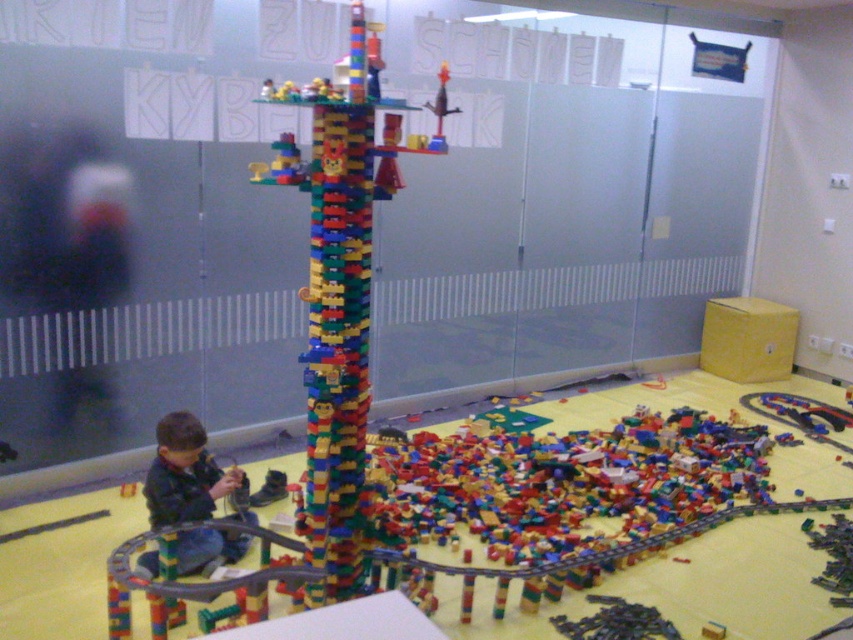
You are a parent trying to find your child who is playing in the play area. You see the multicolored plastic tower at center and the dark blue denim jacket at lower left. Which object is closer to the entrance of the play area?

The dark blue denim jacket at lower left is closer to the entrance because it is positioned to the left of the multicolored plastic tower at center, which is further to the right.

You are a parent trying to clean up the LEGO bricks scattered around the play area. The multicolored plastic tower at center is located at point (339, 305). Where should you place the tower to avoid blocking the main play area? Please provide coordinates in the format of point 0.5, 0.5.

The multicolored plastic tower at center is located at point (339, 305). To avoid blocking the main play area, you should move it to point 0.7, 0.6.

You are a parent standing at the edge of the play area and want to hand your child a new LEGO brick. The multicolored plastic tower at center is in the way. Can you safely walk around it without knocking it over?

The multicolored plastic tower at center is 7.34 feet from the camera, so yes, you can safely walk around it without knocking it over as there is enough distance between you and the tower.